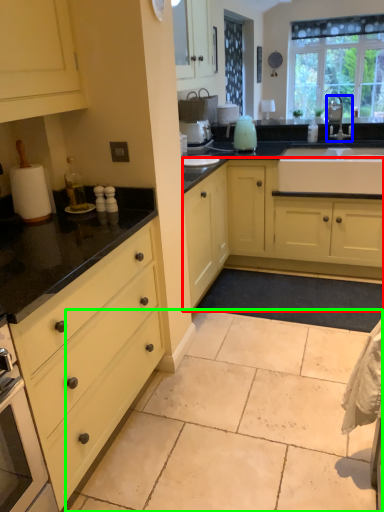
Question: Which object is the farthest from cabinetry (highlighted by a red box)? Choose among these: tap (highlighted by a blue box) or granite (highlighted by a green box).

Choices:
 (A) tap
 (B) granite

Answer: (A)